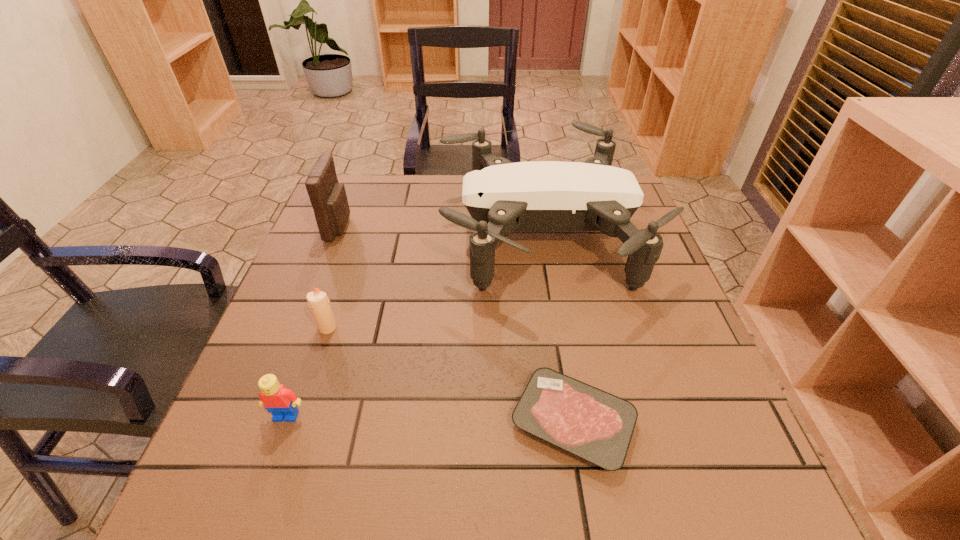
Where is `free space between the third nearest object and the Lego`? The height and width of the screenshot is (540, 960). free space between the third nearest object and the Lego is located at coordinates (307, 372).

Find the location of a particular element. The height and width of the screenshot is (540, 960). vacant space in between the candle and the steak is located at coordinates (450, 375).

I want to click on empty location between the third farthest object and the pouch, so [x=333, y=277].

Find the location of a particular element. The image size is (960, 540). free spot between the steak and the third farthest object is located at coordinates (450, 375).

Image resolution: width=960 pixels, height=540 pixels. I want to click on empty location between the steak and the pouch, so point(456,324).

Identify the location of free spot between the Lego and the shortest object. The width and height of the screenshot is (960, 540). (430, 419).

Image resolution: width=960 pixels, height=540 pixels. In order to click on free spot between the drone and the Lego in this screenshot , I will do `click(415, 325)`.

You are a GUI agent. You are given a task and a screenshot of the screen. Output one action in this format:
    pyautogui.click(x=<x>, y=<y>)
    Task: Click on the second closest object to the Lego
    The image size is (960, 540).
    Given the screenshot: What is the action you would take?
    pyautogui.click(x=501, y=196)

Identify the location of object that can be found as the second closest to the third nearest object. The width and height of the screenshot is (960, 540). (501, 196).

The width and height of the screenshot is (960, 540). In order to click on free spot that satisfies the following two spatial constraints: 1. with an open flap on the pouch; 2. on the left side of the shortest object in this screenshot , I will do `click(264, 422)`.